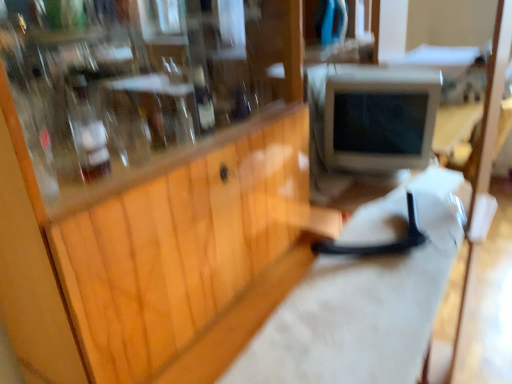
Question: From a real-world perspective, is translucent glass bottle at center, which is the second bottle from left to right, physically located above or below translucent glass bottle at upper left, which is counted as the first bottle, starting from the left?

Choices:
 (A) below
 (B) above

Answer: (A)

Question: Relative to translucent glass bottle at upper left, the second bottle when ordered from back to front, is translucent glass bottle at center, arranged as the first bottle when viewed from the right, in front or behind?

Choices:
 (A) behind
 (B) front

Answer: (A)

Question: Estimate the real-world distances between objects in this image. Which object is farther from the translucent glass bottle at upper left, which is counted as the first bottle, starting from the left?

Choices:
 (A) wooden cabinet at center
 (B) translucent glass bottle at center, arranged as the first bottle when viewed from the right
 (C) white plastic computer monitor at center
 (D) white matte workbench at center

Answer: (C)

Question: Which object is positioned farthest from the wooden cabinet at center?

Choices:
 (A) translucent glass bottle at center, which is the 2th bottle in front-to-back order
 (B) translucent glass bottle at upper left, placed as the first bottle when sorted from front to back
 (C) white plastic computer monitor at center
 (D) white matte workbench at center

Answer: (C)